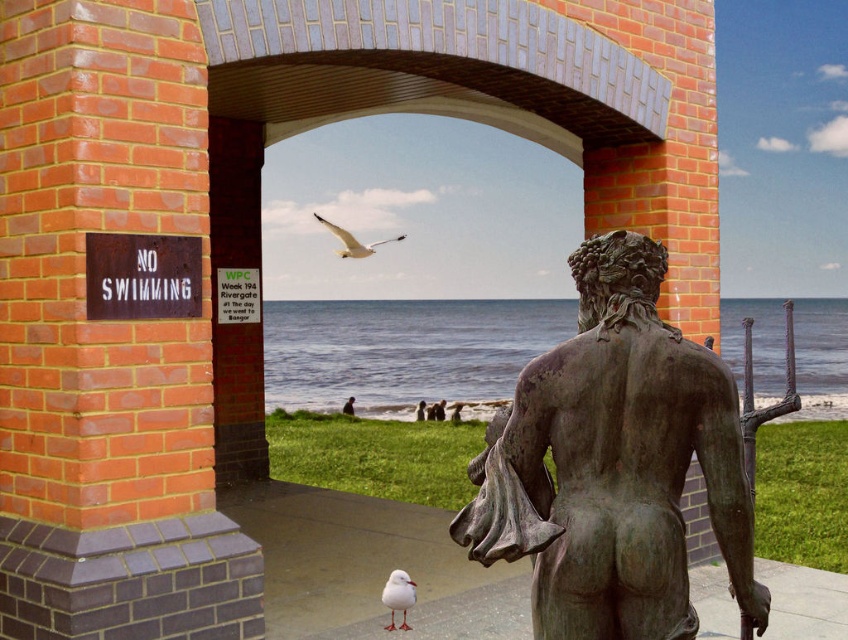
The height and width of the screenshot is (640, 848). What do you see at coordinates (142, 276) in the screenshot?
I see `rusty metal sign at left` at bounding box center [142, 276].

Is point (182, 275) closer to viewer compared to point (339, 236)?

Yes, it is.

Does point (90, 310) lie behind point (330, 227)?

No, (90, 310) is in front of (330, 227).

This screenshot has height=640, width=848. Find the location of `rusty metal sign at left`. rusty metal sign at left is located at coordinates (142, 276).

Is blue water at center closer to the viewer compared to white feathered bird at center?

Yes, it is.

How far apart are blue water at center and white feathered bird at center?

They are 15.99 feet apart.

Who is more distant from viewer, (846, 317) or (353, 243)?

The point (846, 317) is more distant.

This screenshot has width=848, height=640. Find the location of `blue water at center`. blue water at center is located at coordinates (403, 349).

Is rusty metal sign at left wider than white matte bird at lower center?

Yes, rusty metal sign at left is wider than white matte bird at lower center.

Which is above, rusty metal sign at left or white matte bird at lower center?

rusty metal sign at left

Find the location of `rusty metal sign at left`. rusty metal sign at left is located at coordinates (142, 276).